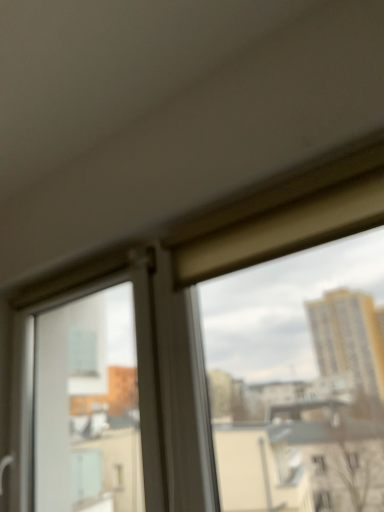
What do you see at coordinates (93, 398) in the screenshot?
I see `transparent glass window at center` at bounding box center [93, 398].

Where is `transparent glass window at center`? transparent glass window at center is located at coordinates (93, 398).

Image resolution: width=384 pixels, height=512 pixels. Identify the location of transparent glass window at center. (93, 398).